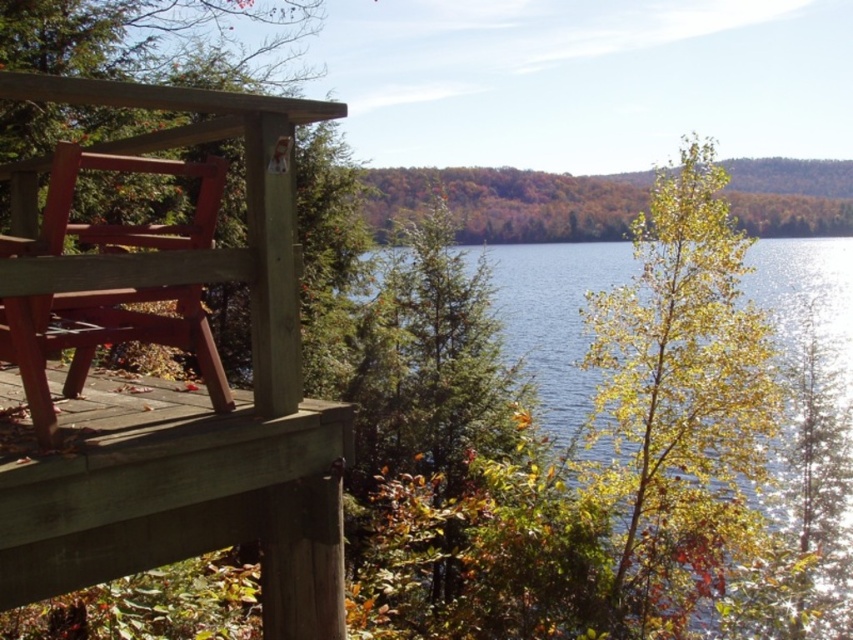
Does wooden bench at left appear on the left side of matte red park bench at left?

Indeed, wooden bench at left is positioned on the left side of matte red park bench at left.

Who is positioned more to the left, wooden bench at left or matte red park bench at left?

wooden bench at left is more to the left.

Who is more distant from viewer, (287, 250) or (138, 291)?

Positioned behind is point (287, 250).

At what (x,y) coordinates should I click in order to perform the action: click on wooden bench at left. Please return your answer as a coordinate pair (x, y). The image size is (853, 640). Looking at the image, I should click on (183, 397).

Between wooden deck at lower left and matte red park bench at left, which one is positioned lower?

wooden deck at lower left is lower down.

Is wooden deck at lower left below matte red park bench at left?

Yes.

Measure the distance between wooden deck at lower left and camera.

wooden deck at lower left is 2.41 meters away from camera.

This screenshot has width=853, height=640. What are the coordinates of `wooden deck at lower left` in the screenshot? It's located at (x=180, y=497).

Does wooden bench at left have a greater height compared to wooden deck at lower left?

Correct, wooden bench at left is much taller as wooden deck at lower left.

Which is more to the right, wooden bench at left or wooden deck at lower left?

Positioned to the right is wooden bench at left.

Who is more forward, [187,499] or [105,499]?

Point [105,499] is more forward.

I want to click on wooden bench at left, so click(183, 397).